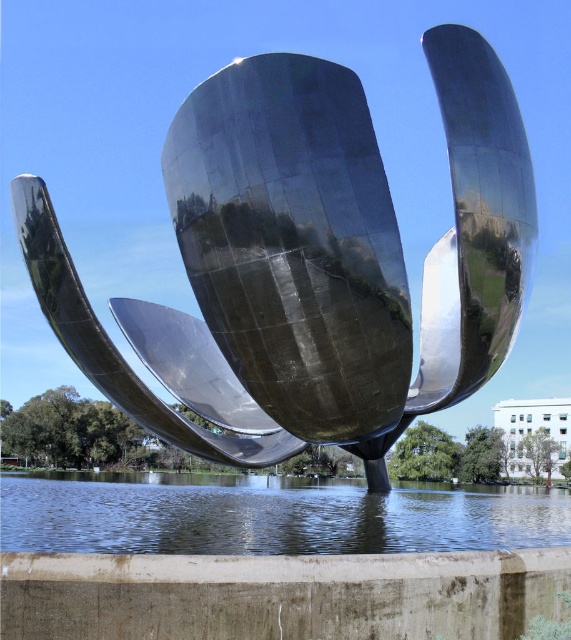
You are standing in front of the sculpture and want to take a photo of the transparent water at lower center without the polished metal flower at center blocking the view. Is it possible to do so by moving closer to the water?

The polished metal flower at center is further to the viewer than transparent water at lower center. Moving closer to the water would bring you closer to the water and farther from the flower, potentially allowing you to position yourself where the flower no longer blocks the view of the water.

You are an artist planning to photograph the polished metal flower at center and the transparent water at lower center. Which object appears smaller in the photo?

The polished metal flower at center appears smaller in the photo because it has a smaller size compared to the transparent water at lower center.